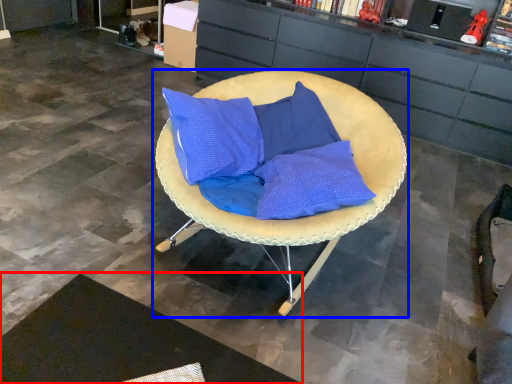
Question: Which object appears farthest to the camera in this image, mat (highlighted by a red box) or chair (highlighted by a blue box)?

Choices:
 (A) mat
 (B) chair

Answer: (B)